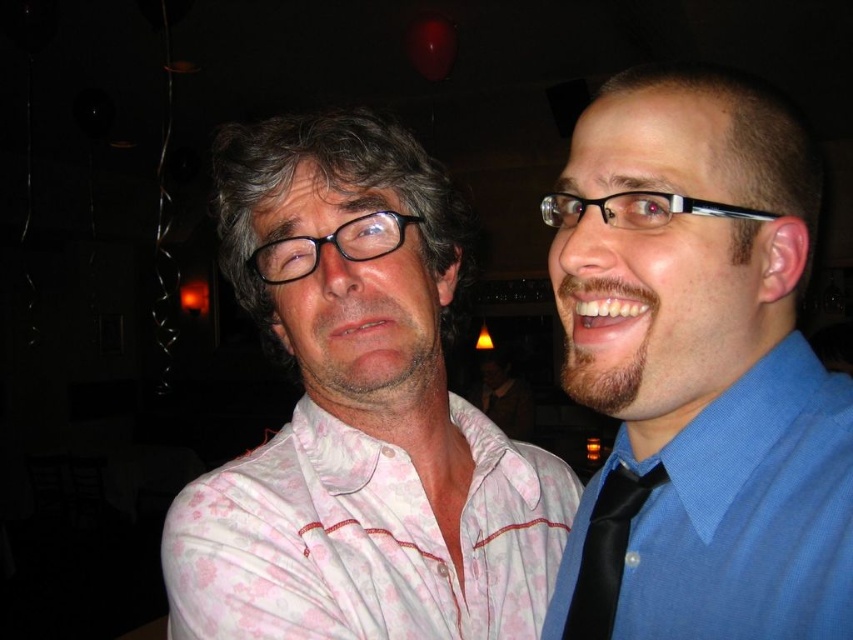
Who is shorter, pink floral dress shirt at center or black satin tie at right?

With less height is black satin tie at right.

Where is `pink floral dress shirt at center`? This screenshot has width=853, height=640. pink floral dress shirt at center is located at coordinates tap(364, 540).

This screenshot has width=853, height=640. In order to click on pink floral dress shirt at center in this screenshot , I will do `click(364, 540)`.

Find the location of a particular element. white floral shirt at center is located at coordinates (358, 416).

Can you confirm if white floral shirt at center is positioned to the right of pink floral dress shirt at center?

In fact, white floral shirt at center is to the left of pink floral dress shirt at center.

Locate an element on the screen. The width and height of the screenshot is (853, 640). white floral shirt at center is located at coordinates (358, 416).

Locate an element on the screen. blue smooth shirt at right is located at coordinates (698, 371).

Identify the location of blue smooth shirt at right. The image size is (853, 640). (698, 371).